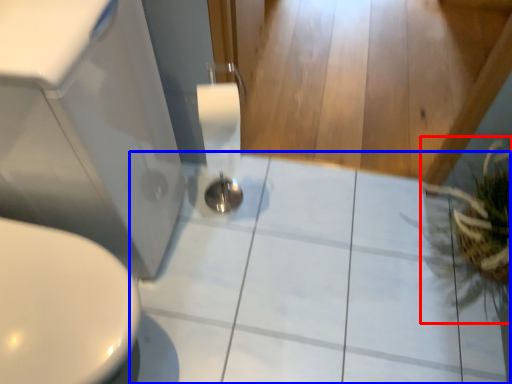
Question: Which object is closer to the camera taking this photo, plant (highlighted by a red box) or ceramic tile (highlighted by a blue box)?

Choices:
 (A) plant
 (B) ceramic tile

Answer: (A)